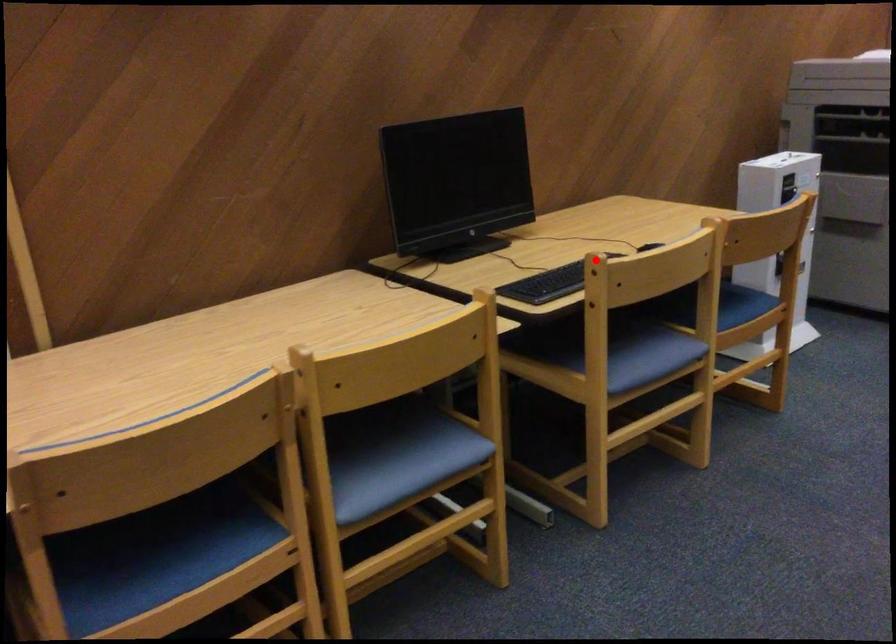
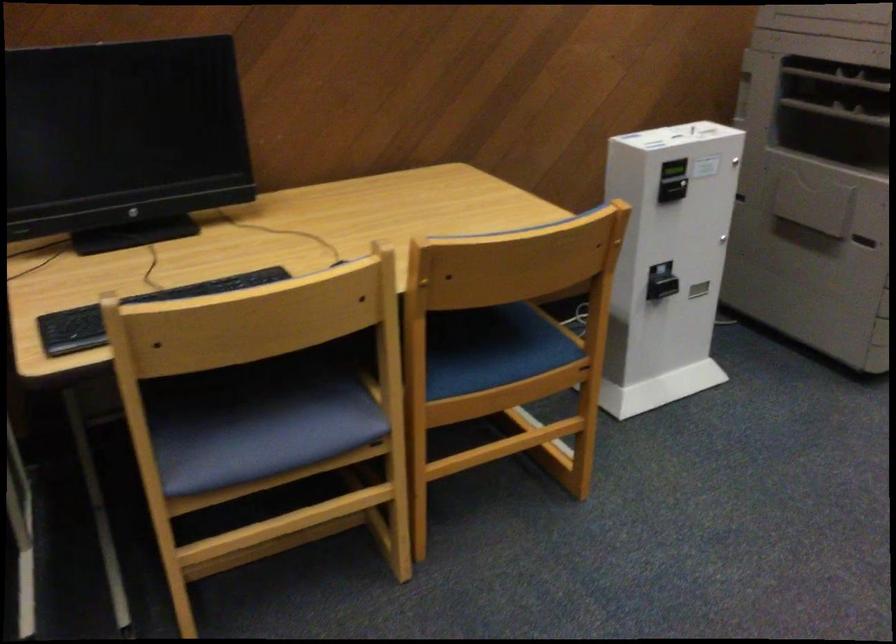
Question: I am providing you with two images of the same scene from different viewpoints. Given a red point in image1, look at the same physical point in image2. Is it:

Choices:
 (A) Closer to the viewpoint
 (B) Farther from the viewpoint

Answer: (A)